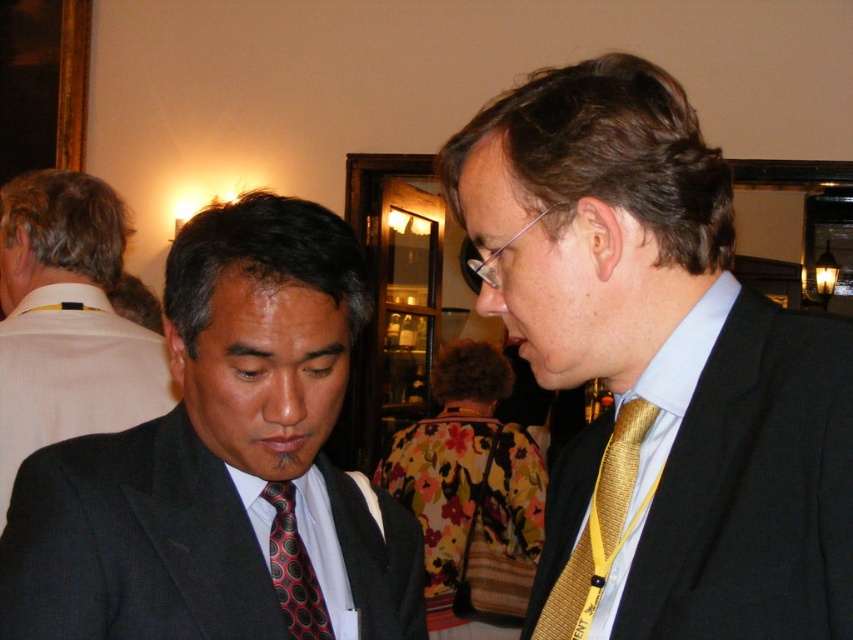
You are standing in front of the two people at the formal event. Which of the two points, point [569,269] or point [563,595], is closer to you?

Point [569,269] is closer to the viewer than point [563,595].

You are standing in a conference room and see the black suit at left and the light blue satin dress shirt at right. Which one is closer to you?

The black suit at left is closer to you because it is further to the viewer than the light blue satin dress shirt at right.

You are at a conference and need to take a photo of both the gold textured tie at center and the red dotted tie at center. Which tie should you focus on first to ensure both are in clear focus?

You should focus on the gold textured tie at center first because it is closer to the viewer than the red dotted tie at center, so adjusting focus from near to far will help both be in clear focus.